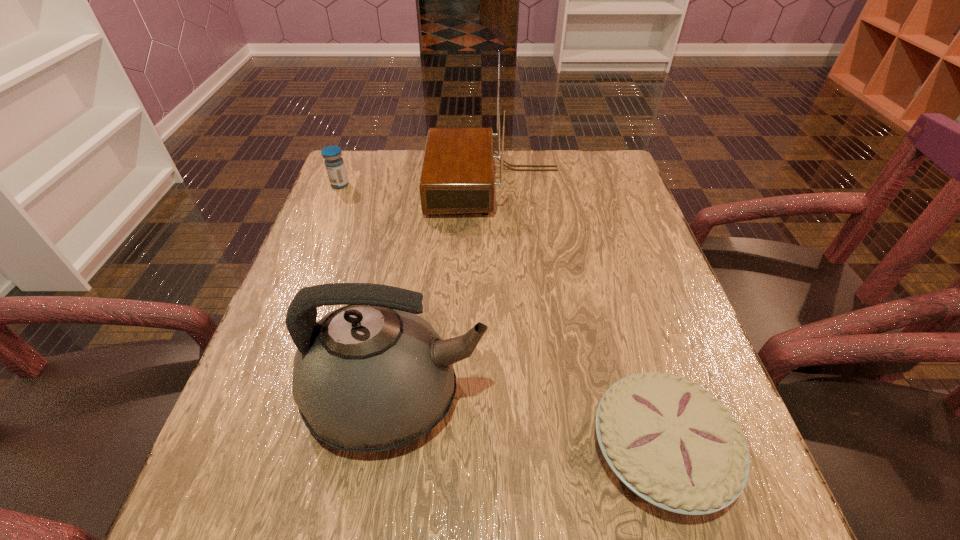
At what (x,y) coordinates should I click in order to perform the action: click on vacant space located on the back of the pie. Please return your answer as a coordinate pair (x, y). This screenshot has height=540, width=960. Looking at the image, I should click on (606, 261).

The width and height of the screenshot is (960, 540). Identify the location of radio_receiver that is at the far edge. (457, 177).

At what (x,y) coordinates should I click in order to perform the action: click on medicine that is at the far edge. Please return your answer as a coordinate pair (x, y). Looking at the image, I should click on (334, 163).

You are a GUI agent. You are given a task and a screenshot of the screen. Output one action in this format:
    pyautogui.click(x=<x>, y=<y>)
    Task: Click on the object that is at the near edge
    The height and width of the screenshot is (540, 960).
    Given the screenshot: What is the action you would take?
    click(x=672, y=443)

The height and width of the screenshot is (540, 960). In order to click on kettle present at the left edge in this screenshot , I will do `click(371, 376)`.

The width and height of the screenshot is (960, 540). I want to click on medicine located in the left edge section of the desktop, so pyautogui.click(x=334, y=163).

Identify the location of object that is positioned at the right edge. The height and width of the screenshot is (540, 960). (672, 443).

Locate an element on the screen. The image size is (960, 540). object positioned at the far left corner is located at coordinates (334, 163).

Find the location of a particular element. object located in the near right corner section of the desktop is located at coordinates (672, 443).

The image size is (960, 540). I want to click on blank area at the far edge, so click(x=393, y=195).